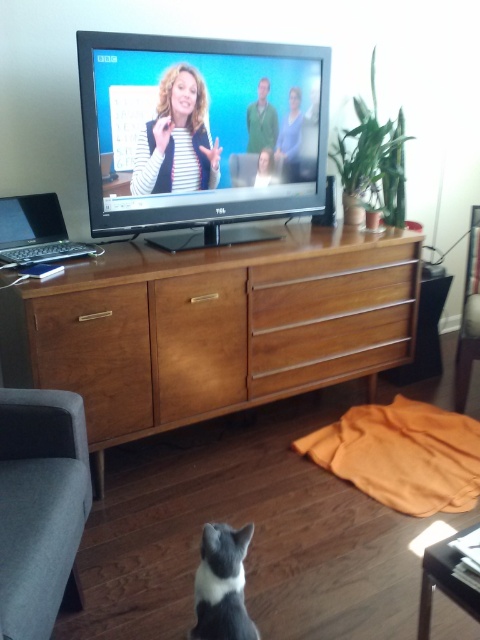
You are setting up a new TV mount and need to know the vertical distance between the brown wood entertainment center at center and the flat screen tv at upper center to ensure proper installation. Can you determine if there is enough space between them for the mount?

The brown wood entertainment center at center is positioned below the flat screen tv at upper center, so there is sufficient vertical space between them for the TV mount installation.

You are a guest in this living room and want to place a rectangular coffee table between the flat screen tv at upper center and the gray fabric armchair at lower left. The coffee table is 1.2 meters wide. Can the coffee table fit between them horizontally?

The flat screen tv at upper center is wider than the gray fabric armchair at lower left. Since the coffee table is 1.2 meters wide, it depends on the available space between them. However, without specific distance information between the two objects, we cannot definitively determine if the coffee table will fit. Please measure the space between the flat screen tv at upper center and the gray fabric armchair at lower left first.

You are a delivery person who needs to place a rectangular package that measures 20 inches in length. You have to position it between the flat screen tv at upper center and the wooden drawer at center. Can the package fit in the space between them?

The distance between the flat screen tv at upper center and the wooden drawer at center is 22.45 inches. Since the package is 20 inches long, it can fit in the space between them as the available space is larger than the package length.